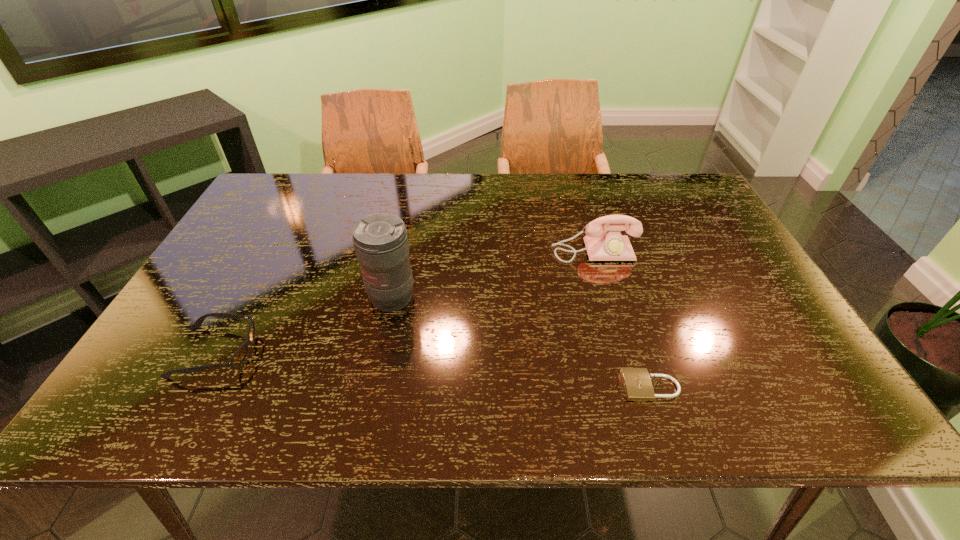
At what (x,y) coordinates should I click in order to perform the action: click on the second object from left to right. Please return your answer as a coordinate pair (x, y). The height and width of the screenshot is (540, 960). Looking at the image, I should click on (380, 240).

Find the location of a particular element. The width and height of the screenshot is (960, 540). telephoto lens is located at coordinates (380, 240).

Find the location of a particular element. the farthest object is located at coordinates (608, 244).

You are a GUI agent. You are given a task and a screenshot of the screen. Output one action in this format:
    pyautogui.click(x=<x>, y=<y>)
    Task: Click on the telephone
    The width and height of the screenshot is (960, 540).
    Given the screenshot: What is the action you would take?
    pyautogui.click(x=608, y=244)

At what (x,y) coordinates should I click in order to perform the action: click on spectacles. Please return your answer as a coordinate pair (x, y). The width and height of the screenshot is (960, 540). Looking at the image, I should click on (237, 359).

At what (x,y) coordinates should I click in order to perform the action: click on the third tallest object. Please return your answer as a coordinate pair (x, y). This screenshot has width=960, height=540. Looking at the image, I should click on (237, 359).

I want to click on the shortest object, so pos(637,384).

The width and height of the screenshot is (960, 540). I want to click on free space located on the side of the tallest object where the control switches are located, so click(384, 335).

Identify the location of free space located on the dial of the third shortest object. (636, 390).

The width and height of the screenshot is (960, 540). In order to click on vacant region located 0.350m on the front-facing side of the third tallest object in this screenshot , I will do `click(410, 352)`.